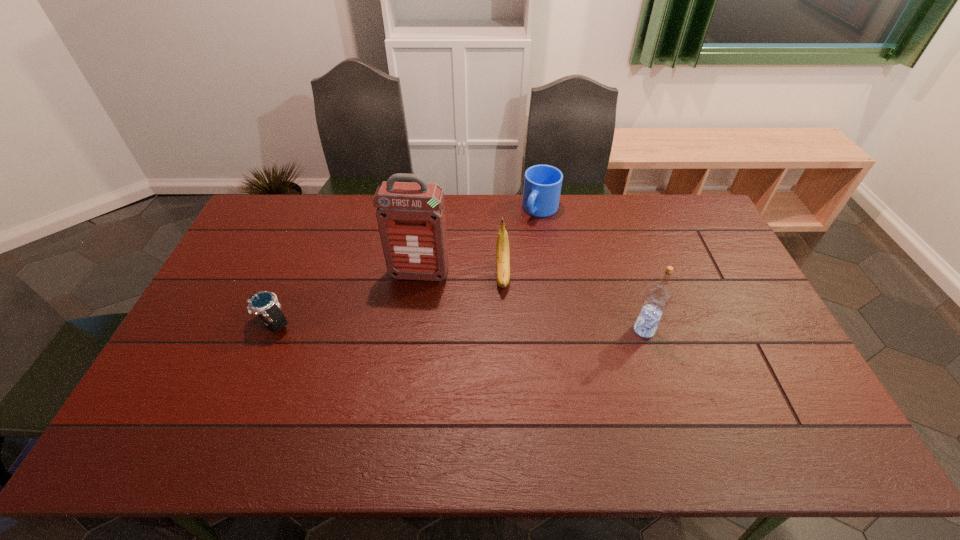
At what (x,y) coordinates should I click in order to perform the action: click on free space between the shortest object and the fourth object from right to left. Please return your answer as a coordinate pair (x, y). The width and height of the screenshot is (960, 540). Looking at the image, I should click on (347, 299).

Find the location of a particular element. free space between the leftmost object and the third shortest object is located at coordinates (389, 299).

Locate an element on the screen. Image resolution: width=960 pixels, height=540 pixels. free area in between the fourth shortest object and the leftmost object is located at coordinates (459, 327).

The width and height of the screenshot is (960, 540). Identify the location of vacant area that lies between the first-aid kit and the third tallest object. (461, 274).

Image resolution: width=960 pixels, height=540 pixels. I want to click on free space that is in between the second shortest object and the fourth object from right to left, so (480, 242).

Identify the location of free space that is in between the second tallest object and the second object from left to right. (532, 302).

Find the location of a particular element. This screenshot has width=960, height=540. the third closest object to the watch is located at coordinates (542, 183).

This screenshot has width=960, height=540. I want to click on object that stands as the fourth closest to the third object from right to left, so click(x=265, y=304).